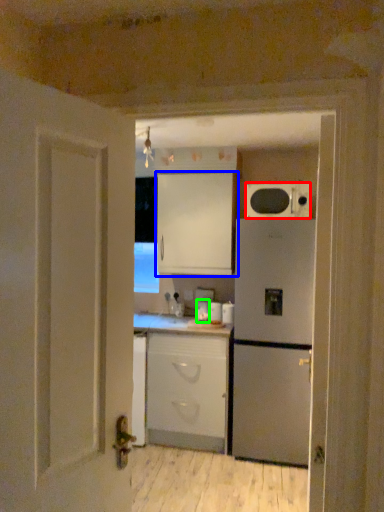
Question: Which object is the closest to the microwave oven (highlighted by a red box)? Choose among these: cabinetry (highlighted by a blue box) or appliance (highlighted by a green box).

Choices:
 (A) cabinetry
 (B) appliance

Answer: (A)